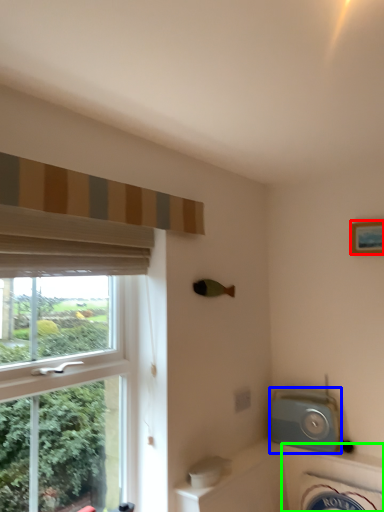
Question: Which is nearer to the picture frame (highlighted by a red box)? appliance (highlighted by a blue box) or bath (highlighted by a green box).

Choices:
 (A) appliance
 (B) bath

Answer: (A)